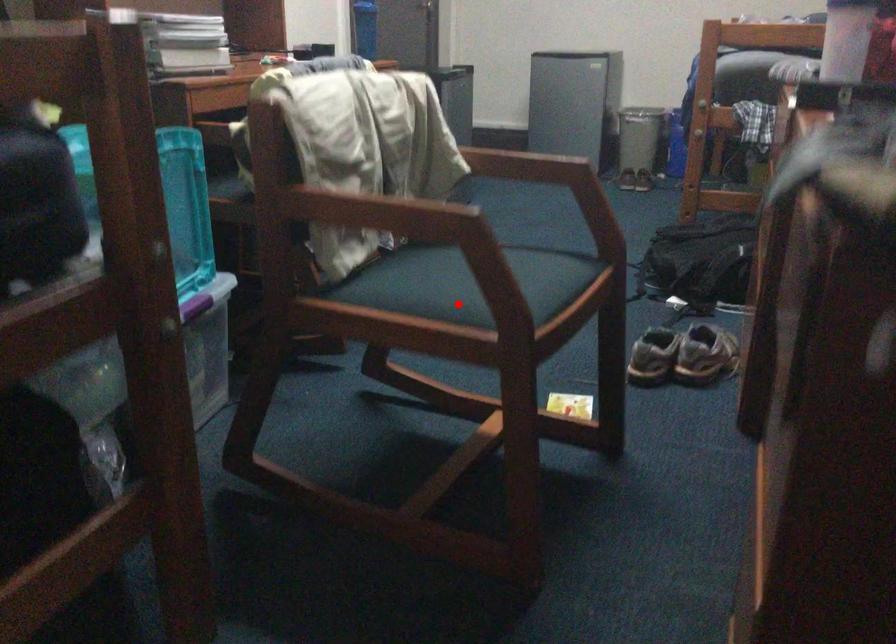
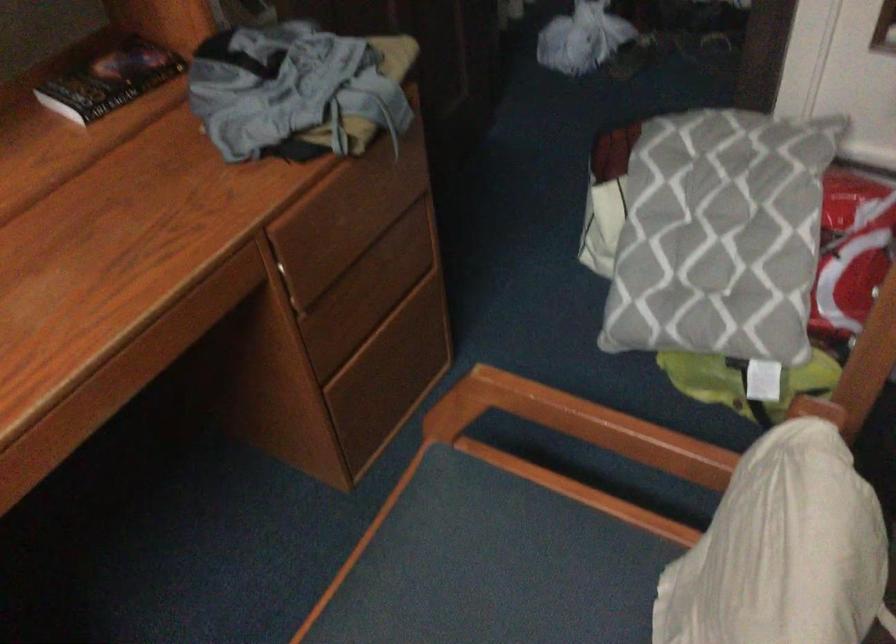
Question: A red point is marked in image1. In image2, is the corresponding 3D point closer to the camera or farther? Reply with the corresponding letter.

Choices:
 (A) The corresponding 3D point is closer.
 (B) The corresponding 3D point is farther.

Answer: (A)